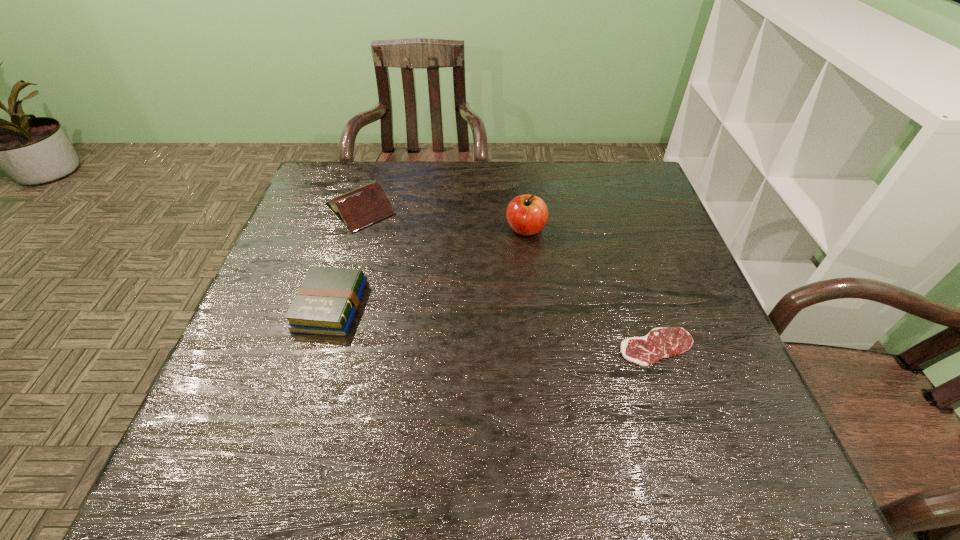
Image resolution: width=960 pixels, height=540 pixels. What are the coordinates of `vacant space situated 0.250m on the back of the shorter book` in the screenshot? It's located at (358, 215).

In order to click on vacant area situated on the front of the steak in this screenshot , I will do `click(686, 438)`.

At what (x,y) coordinates should I click in order to perform the action: click on object that is positioned at the far edge. Please return your answer as a coordinate pair (x, y). The height and width of the screenshot is (540, 960). Looking at the image, I should click on (361, 207).

Where is `object located at the right edge`? Image resolution: width=960 pixels, height=540 pixels. object located at the right edge is located at coordinates (659, 343).

At what (x,y) coordinates should I click in order to perform the action: click on object located at the far left corner. Please return your answer as a coordinate pair (x, y). The width and height of the screenshot is (960, 540). Looking at the image, I should click on (361, 207).

At what (x,y) coordinates should I click in order to perform the action: click on free region at the far edge of the desktop. Please return your answer as a coordinate pair (x, y). Looking at the image, I should click on coord(420,174).

Locate an element on the screen. This screenshot has width=960, height=540. vacant space at the near edge of the desktop is located at coordinates (640, 476).

Where is `free space at the left edge`? The height and width of the screenshot is (540, 960). free space at the left edge is located at coordinates (339, 231).

Where is `vacant area at the right edge`? This screenshot has width=960, height=540. vacant area at the right edge is located at coordinates (737, 429).

In the image, there is a desktop. Where is `vacant space at the far left corner`? vacant space at the far left corner is located at coordinates (365, 179).